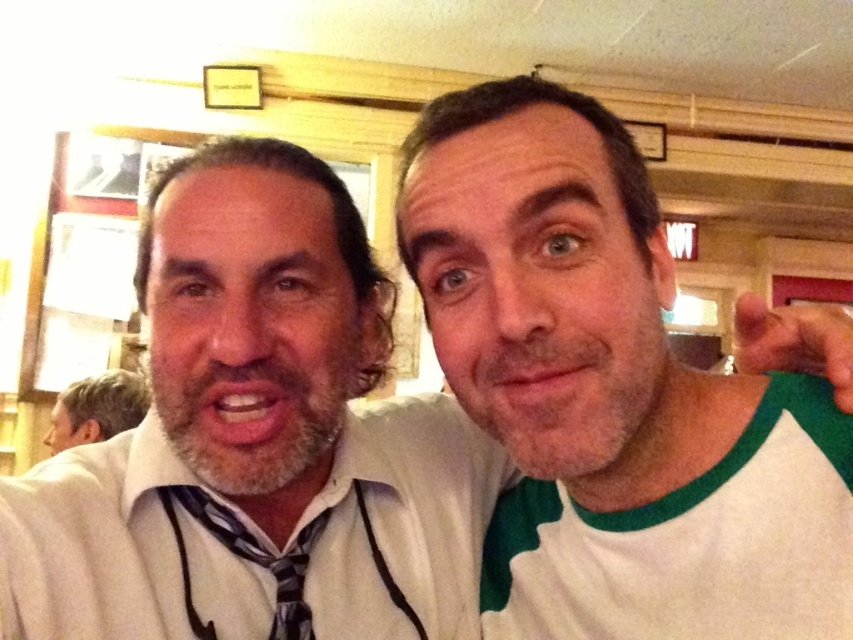
Can you confirm if white cotton t-shirt at right is thinner than gray hair at left?

Correct, white cotton t-shirt at right's width is less than gray hair at left's.

Between point (561, 628) and point (109, 378), which one is positioned behind?

Point (109, 378)

Find the location of a particular element. white cotton t-shirt at right is located at coordinates (691, 541).

From the picture: Is white/green raglan shirt at right thinner than white cotton t-shirt at right?

Incorrect, white/green raglan shirt at right's width is not less than white cotton t-shirt at right's.

Describe the element at coordinates (614, 392) in the screenshot. I see `white/green raglan shirt at right` at that location.

Identify the location of white/green raglan shirt at right. (614, 392).

At what (x,y) coordinates should I click in order to perform the action: click on white/green raglan shirt at right. Please return your answer as a coordinate pair (x, y). Looking at the image, I should click on (614, 392).

Is point (664, 620) farther from camera compared to point (140, 416)?

No, it is not.

Locate an element on the screen. This screenshot has height=640, width=853. white/green raglan shirt at right is located at coordinates (614, 392).